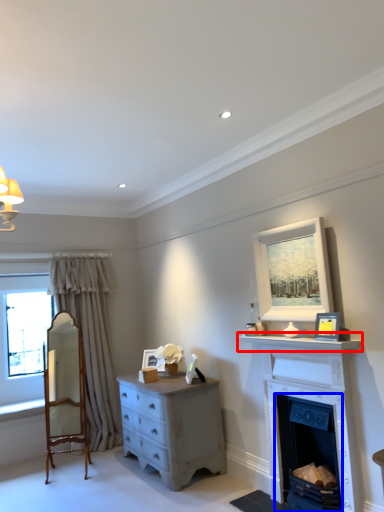
Question: Among these objects, which one is nearest to the camera, mantle (highlighted by a red box) or fireplace (highlighted by a blue box)?

Choices:
 (A) mantle
 (B) fireplace

Answer: (A)